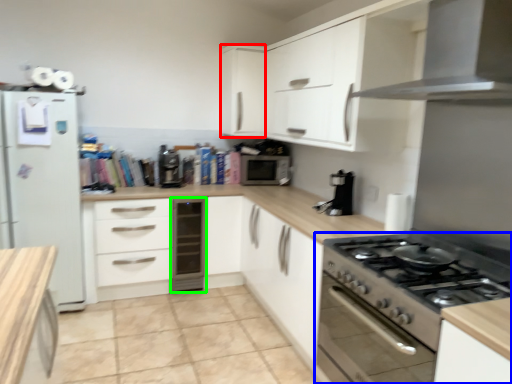
Question: Which is farther away from cabinetry (highlighted by a red box)? kitchen appliance (highlighted by a blue box) or dish washer (highlighted by a green box)?

Choices:
 (A) kitchen appliance
 (B) dish washer

Answer: (A)